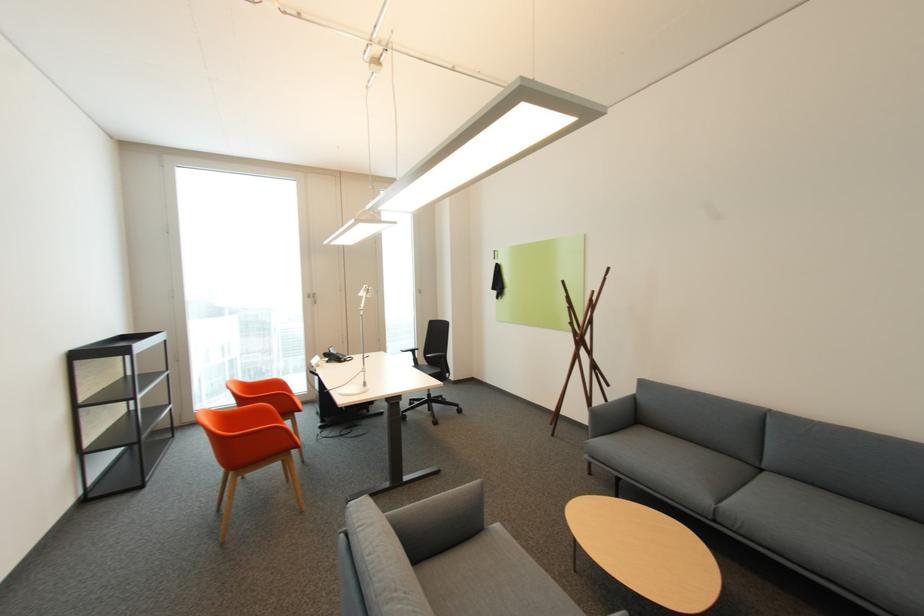
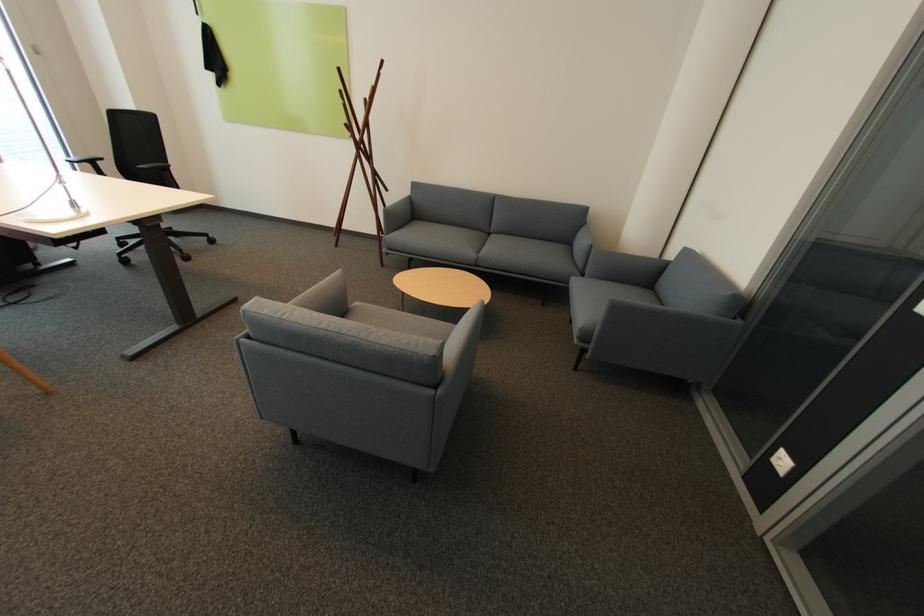
The point at (578, 325) is marked in the first image. Where is the corresponding point in the second image?

(355, 126)